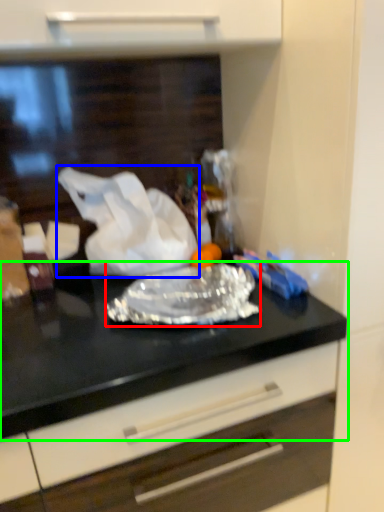
Question: Considering the real-world distances, which object is closest to wrap (highlighted by a red box)? wrapping paper (highlighted by a blue box) or countertop (highlighted by a green box).

Choices:
 (A) wrapping paper
 (B) countertop

Answer: (B)